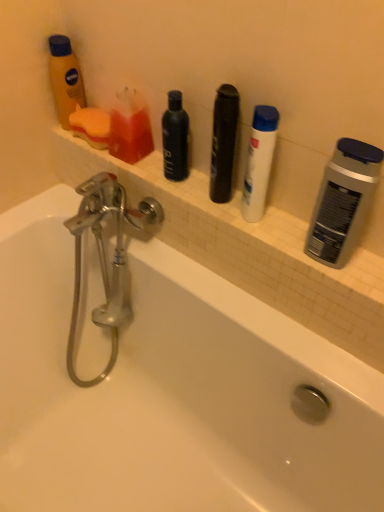
Question: Considering the positions of white matte shampoo at center, the third toiletry in the left-to-right sequence, and matte orange lotion at upper left, marked as the third toiletry in a right-to-left arrangement, in the image, is white matte shampoo at center, the third toiletry in the left-to-right sequence, wider or thinner than matte orange lotion at upper left, marked as the third toiletry in a right-to-left arrangement,?

Choices:
 (A) thin
 (B) wide

Answer: (A)

Question: Based on their sizes in the image, would you say white matte shampoo at center, the third toiletry in the left-to-right sequence, is bigger or smaller than matte orange lotion at upper left, which is the 1th toiletry in left-to-right order?

Choices:
 (A) big
 (B) small

Answer: (A)

Question: Which object is positioned closest to the black matte bottle at center, which is the first personal care from back to front?

Choices:
 (A) matte orange lotion at upper left, which is the 1th toiletry in left-to-right order
 (B) translucent plastic soap at upper left, placed as the second toiletry when sorted from right to left
 (C) silver metallic deodorant at right, placed as the first personal care when sorted from right to left
 (D) white matte shampoo at center, the third toiletry in the left-to-right sequence
 (E) beige tile ledge at upper center

Answer: (B)

Question: Which of these objects is positioned farthest from the black matte bottle at center, arranged as the 2th personal care when viewed from the right?

Choices:
 (A) white matte shampoo at center, the third toiletry in the left-to-right sequence
 (B) silver metallic deodorant at right, placed as the first personal care when sorted from right to left
 (C) matte orange lotion at upper left, marked as the third toiletry in a right-to-left arrangement
 (D) translucent plastic soap at upper left, placed as the second toiletry when sorted from right to left
 (E) beige tile ledge at upper center

Answer: (B)